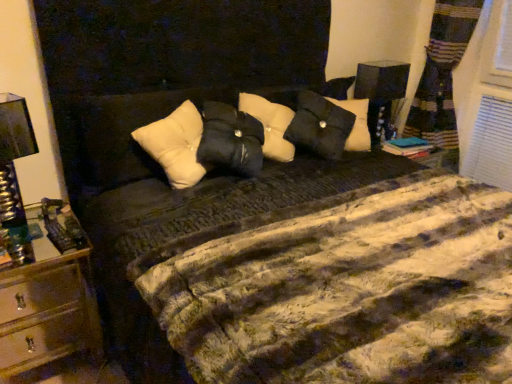
Describe the element at coordinates (49, 296) in the screenshot. I see `metallic gold nightstand at left` at that location.

You are a GUI agent. You are given a task and a screenshot of the screen. Output one action in this format:
    pyautogui.click(x=<x>, y=<y>)
    Task: Click on the metallic gold nightstand at left
    The height and width of the screenshot is (384, 512).
    Given the screenshot: What is the action you would take?
    pyautogui.click(x=49, y=296)

In terms of size, does black fabric lampshade at upper right, acting as the second bedside lamp starting from the left, appear bigger or smaller than metallic gold nightstand at left?

black fabric lampshade at upper right, acting as the second bedside lamp starting from the left, is smaller than metallic gold nightstand at left.

Are black fabric lampshade at upper right, which ranks as the first bedside lamp in back-to-front order, and metallic gold nightstand at left making contact?

black fabric lampshade at upper right, which ranks as the first bedside lamp in back-to-front order, is not next to metallic gold nightstand at left, and they're not touching.

Is black fabric lampshade at upper right, which is counted as the second bedside lamp, starting from the bottom, inside the boundaries of metallic gold nightstand at left, or outside?

black fabric lampshade at upper right, which is counted as the second bedside lamp, starting from the bottom, is located beyond the bounds of metallic gold nightstand at left.

Which is in front, point (358, 98) or point (70, 352)?

The point (70, 352) is more forward.

Considering the relative sizes of metallic silver lamp at left, marked as the second bedside lamp in a right-to-left arrangement, and black fabric lampshade at upper right, which ranks as the first bedside lamp in back-to-front order, in the image provided, is metallic silver lamp at left, marked as the second bedside lamp in a right-to-left arrangement, smaller than black fabric lampshade at upper right, which ranks as the first bedside lamp in back-to-front order,?

Correct, metallic silver lamp at left, marked as the second bedside lamp in a right-to-left arrangement, occupies less space than black fabric lampshade at upper right, which ranks as the first bedside lamp in back-to-front order.

Does metallic silver lamp at left, which is the first bedside lamp in left-to-right order, turn towards black fabric lampshade at upper right, which is counted as the second bedside lamp, starting from the bottom?

No.

Does metallic silver lamp at left, which ranks as the 2th bedside lamp in back-to-front order, have a lesser width compared to black fabric lampshade at upper right, arranged as the first bedside lamp when viewed from the right?

No, metallic silver lamp at left, which ranks as the 2th bedside lamp in back-to-front order, is not thinner than black fabric lampshade at upper right, arranged as the first bedside lamp when viewed from the right.

How much distance is there between white soft pillow at center and metallic silver lamp at left, which ranks as the 2th bedside lamp in back-to-front order?

A distance of 22.49 inches exists between white soft pillow at center and metallic silver lamp at left, which ranks as the 2th bedside lamp in back-to-front order.

Does white soft pillow at center touch metallic silver lamp at left, placed as the 1th bedside lamp when sorted from front to back?

No, white soft pillow at center is not making contact with metallic silver lamp at left, placed as the 1th bedside lamp when sorted from front to back.

From a real-world perspective, is white soft pillow at center located higher than metallic silver lamp at left, marked as the second bedside lamp in a right-to-left arrangement?

Yes, from a real-world perspective, white soft pillow at center is on top of metallic silver lamp at left, marked as the second bedside lamp in a right-to-left arrangement.

Between white soft pillow at center and metallic silver lamp at left, marked as the first bedside lamp in a bottom-to-top arrangement, which one appears on the left side from the viewer's perspective?

metallic silver lamp at left, marked as the first bedside lamp in a bottom-to-top arrangement.

Is metallic gold nightstand at left aimed at metallic silver lamp at left, placed as the 1th bedside lamp when sorted from front to back?

No, metallic gold nightstand at left is not facing towards metallic silver lamp at left, placed as the 1th bedside lamp when sorted from front to back.

Which of these two, metallic gold nightstand at left or metallic silver lamp at left, which ranks as the 2th bedside lamp in back-to-front order, stands shorter?

metallic silver lamp at left, which ranks as the 2th bedside lamp in back-to-front order, is shorter.

Is metallic gold nightstand at left far away from metallic silver lamp at left, which is the second bedside lamp in top-to-bottom order?

No, metallic gold nightstand at left is not far from metallic silver lamp at left, which is the second bedside lamp in top-to-bottom order.

Considering the relative sizes of metallic gold nightstand at left and metallic silver lamp at left, placed as the 1th bedside lamp when sorted from front to back, in the image provided, is metallic gold nightstand at left bigger than metallic silver lamp at left, placed as the 1th bedside lamp when sorted from front to back,?

Yes.

Are white soft pillow at center and black fabric lampshade at upper right, acting as the second bedside lamp starting from the left, making contact?

No, white soft pillow at center is not making contact with black fabric lampshade at upper right, acting as the second bedside lamp starting from the left.

In the scene shown: Who is smaller, white soft pillow at center or black fabric lampshade at upper right, arranged as the first bedside lamp when viewed from the right?

black fabric lampshade at upper right, arranged as the first bedside lamp when viewed from the right, is smaller.

Considering the positions of points (158, 132) and (372, 105), is point (158, 132) closer to camera compared to point (372, 105)?

Yes, it is in front of point (372, 105).

From a real-world perspective, between white soft pillow at center and black fabric lampshade at upper right, the second bedside lamp when ordered from front to back, who is vertically lower?

In real-world perspective, black fabric lampshade at upper right, the second bedside lamp when ordered from front to back, is lower.

Looking at their sizes, would you say black fabric lampshade at upper right, the first bedside lamp from the top, is wider or thinner than white soft pillow at center?

black fabric lampshade at upper right, the first bedside lamp from the top, is thinner than white soft pillow at center.

Is black fabric lampshade at upper right, arranged as the first bedside lamp when viewed from the right, positioned with its back to white soft pillow at center?

No, black fabric lampshade at upper right, arranged as the first bedside lamp when viewed from the right, is not facing the opposite direction of white soft pillow at center.

Is there a large distance between black fabric lampshade at upper right, the first bedside lamp from the top, and white soft pillow at center?

Absolutely, black fabric lampshade at upper right, the first bedside lamp from the top, is distant from white soft pillow at center.

Which of these two, black fabric lampshade at upper right, acting as the second bedside lamp starting from the left, or white soft pillow at center, is bigger?

white soft pillow at center.

From the image's perspective, does metallic gold nightstand at left appear lower than black fabric lampshade at upper right, acting as the second bedside lamp starting from the left?

Indeed, from the image's perspective, metallic gold nightstand at left is shown beneath black fabric lampshade at upper right, acting as the second bedside lamp starting from the left.

Is metallic gold nightstand at left taller or shorter than black fabric lampshade at upper right, acting as the second bedside lamp starting from the left?

Considering their sizes, metallic gold nightstand at left has more height than black fabric lampshade at upper right, acting as the second bedside lamp starting from the left.

Is metallic gold nightstand at left facing away from black fabric lampshade at upper right, which ranks as the first bedside lamp in back-to-front order?

metallic gold nightstand at left does not have its back to black fabric lampshade at upper right, which ranks as the first bedside lamp in back-to-front order.

From a real-world perspective, is metallic gold nightstand at left physically below black fabric lampshade at upper right, which ranks as the first bedside lamp in back-to-front order?

Yes, from a real-world perspective, metallic gold nightstand at left is under black fabric lampshade at upper right, which ranks as the first bedside lamp in back-to-front order.

You are a GUI agent. You are given a task and a screenshot of the screen. Output one action in this format:
    pyautogui.click(x=<x>, y=<y>)
    Task: Click on the nightstand below the black fabric lampshade at upper right, acting as the second bedside lamp starting from the left (from the image's perspective)
    
    Given the screenshot: What is the action you would take?
    pyautogui.click(x=49, y=296)

This screenshot has height=384, width=512. In order to click on bedside lamp beneath the metallic silver lamp at left, marked as the first bedside lamp in a bottom-to-top arrangement (from a real-world perspective) in this screenshot , I will do click(381, 94).

Which object lies further to the anchor point metallic silver lamp at left, marked as the first bedside lamp in a bottom-to-top arrangement, white soft pillow at center or metallic gold nightstand at left?

white soft pillow at center lies further to metallic silver lamp at left, marked as the first bedside lamp in a bottom-to-top arrangement, than the other object.

When comparing their distances from black fabric lampshade at upper right, acting as the second bedside lamp starting from the left, does white soft pillow at center or metallic silver lamp at left, marked as the first bedside lamp in a bottom-to-top arrangement, seem further?

Based on the image, metallic silver lamp at left, marked as the first bedside lamp in a bottom-to-top arrangement, appears to be further to black fabric lampshade at upper right, acting as the second bedside lamp starting from the left.

When comparing their distances from metallic gold nightstand at left, does metallic silver lamp at left, placed as the 1th bedside lamp when sorted from front to back, or black fabric lampshade at upper right, arranged as the first bedside lamp when viewed from the right, seem further?

Among the two, black fabric lampshade at upper right, arranged as the first bedside lamp when viewed from the right, is located further to metallic gold nightstand at left.

Based on their spatial positions, is metallic silver lamp at left, marked as the first bedside lamp in a bottom-to-top arrangement, or black fabric lampshade at upper right, the second bedside lamp when ordered from front to back, closer to white soft pillow at center?

metallic silver lamp at left, marked as the first bedside lamp in a bottom-to-top arrangement, is closer to white soft pillow at center.

Looking at the image, which one is located closer to white soft pillow at center, black fabric lampshade at upper right, the first bedside lamp from the top, or metallic silver lamp at left, which ranks as the 2th bedside lamp in back-to-front order?

Result: Among the two, metallic silver lamp at left, which ranks as the 2th bedside lamp in back-to-front order, is located nearer to white soft pillow at center.

Which object lies further to the anchor point black fabric lampshade at upper right, which is counted as the second bedside lamp, starting from the bottom, metallic gold nightstand at left or white soft pillow at center?

metallic gold nightstand at left.

Looking at the image, which one is located further to white soft pillow at center, metallic gold nightstand at left or black fabric lampshade at upper right, which is counted as the second bedside lamp, starting from the bottom?

black fabric lampshade at upper right, which is counted as the second bedside lamp, starting from the bottom, is further to white soft pillow at center.

Looking at the image, which one is located further to black fabric lampshade at upper right, which ranks as the first bedside lamp in back-to-front order, white soft pillow at center or metallic gold nightstand at left?

metallic gold nightstand at left.

The image size is (512, 384). Find the location of `nightstand between metallic silver lamp at left, marked as the second bedside lamp in a right-to-left arrangement, and black fabric lampshade at upper right, acting as the second bedside lamp starting from the left`. nightstand between metallic silver lamp at left, marked as the second bedside lamp in a right-to-left arrangement, and black fabric lampshade at upper right, acting as the second bedside lamp starting from the left is located at coordinates point(49,296).

Locate an element on the screen. This screenshot has width=512, height=384. pillow between metallic gold nightstand at left and black fabric lampshade at upper right, acting as the second bedside lamp starting from the left, in the horizontal direction is located at coordinates (175, 145).

Locate an element on the screen. pillow located between metallic silver lamp at left, which is the second bedside lamp in top-to-bottom order, and black fabric lampshade at upper right, acting as the second bedside lamp starting from the left, in the left-right direction is located at coordinates (175, 145).

I want to click on nightstand between metallic silver lamp at left, which ranks as the 2th bedside lamp in back-to-front order, and white soft pillow at center, so click(49, 296).